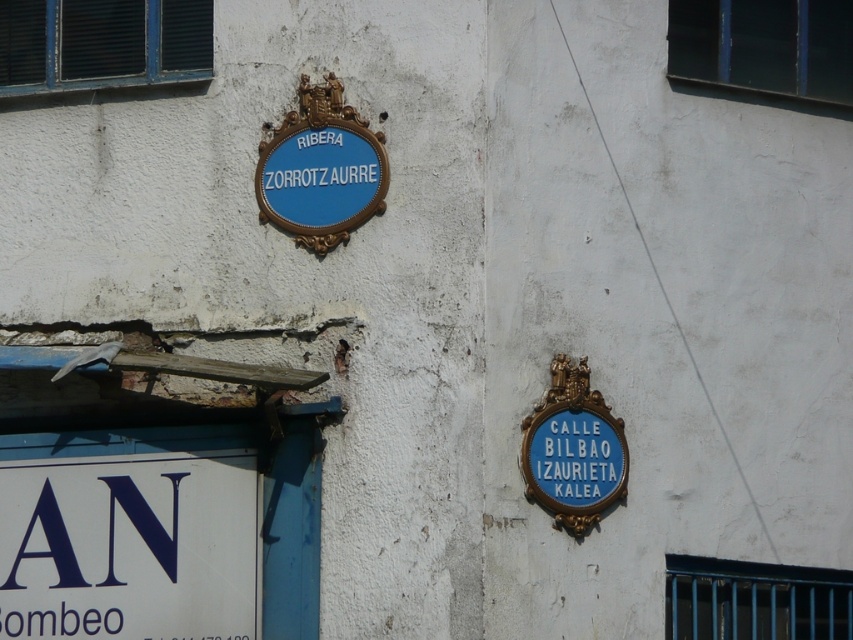
Between white plastic sign at lower left and blue glossy sign at upper left, which one is positioned lower?

white plastic sign at lower left is below.

Where is `white plastic sign at lower left`? This screenshot has width=853, height=640. white plastic sign at lower left is located at coordinates (131, 547).

At what (x,y) coordinates should I click in order to perform the action: click on white plastic sign at lower left. Please return your answer as a coordinate pair (x, y). The width and height of the screenshot is (853, 640). Looking at the image, I should click on (131, 547).

Can you confirm if blue glossy sign at upper left is positioned above blue painted wood sign at right?

Indeed, blue glossy sign at upper left is positioned over blue painted wood sign at right.

Who is positioned more to the right, blue glossy sign at upper left or blue painted wood sign at right?

blue painted wood sign at right

Locate an element on the screen. blue glossy sign at upper left is located at coordinates (321, 170).

Is white plastic sign at lower left shorter than blue painted wood sign at right?

No.

Is point (202, 538) in front of point (611, 476)?

No, it is not.

Find the location of a particular element. white plastic sign at lower left is located at coordinates (131, 547).